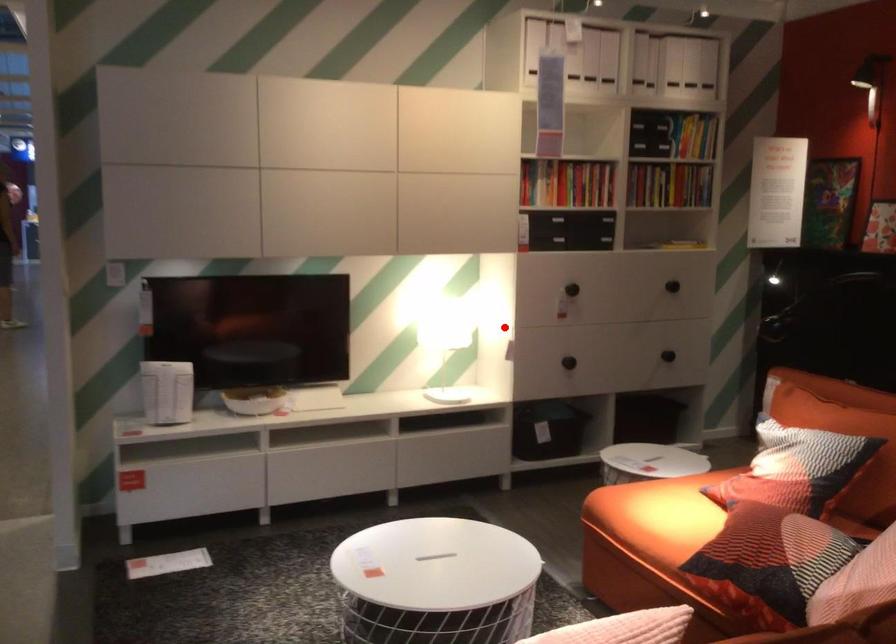
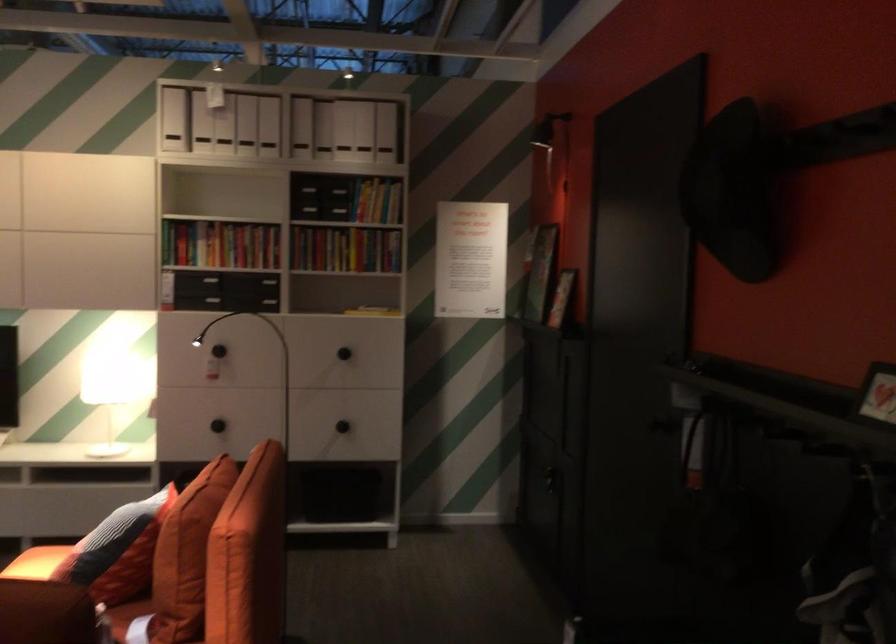
Locate, in the second image, the point that corresponds to the highlighted location in the first image.

(108, 391)